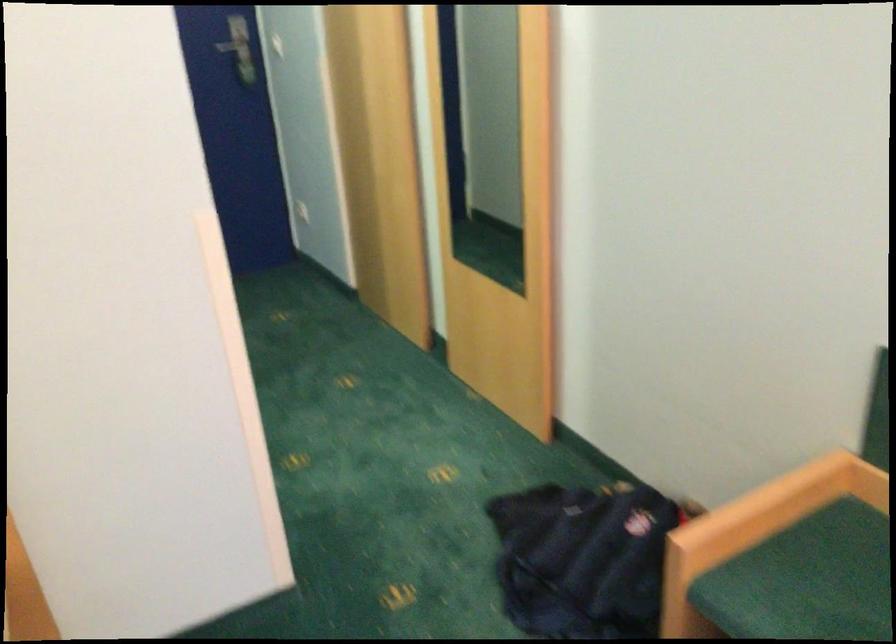
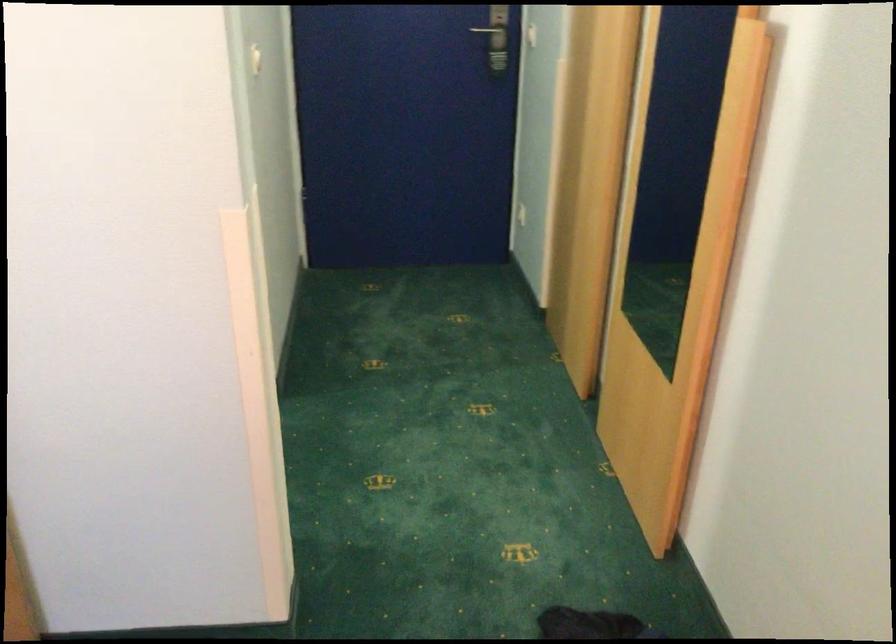
Question: The camera is either moving clockwise (left) or counter-clockwise (right) around the object. The first image is from the beginning of the video and the second image is from the end. Is the camera moving left or right when shooting the video?

Choices:
 (A) Left
 (B) Right

Answer: (B)